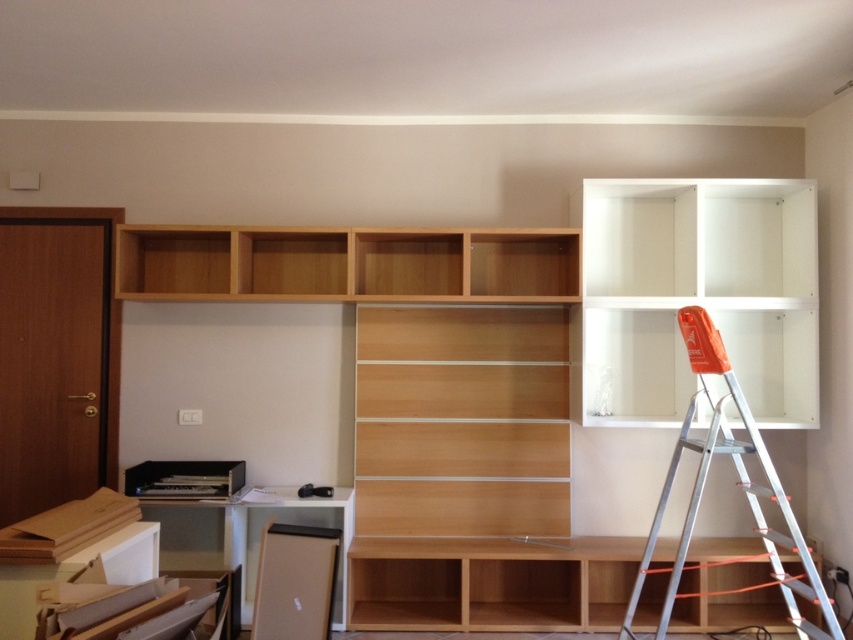
Question: Which of the following is the farthest from the observer?

Choices:
 (A) white matte shelf at upper right
 (B) light wood shelf at center
 (C) silver metallic ladder at upper right
 (D) light wood shelves at center

Answer: (A)

Question: Is white matte cabinet at upper right below white matte shelf at upper right?

Choices:
 (A) yes
 (B) no

Answer: (B)

Question: Does white matte cabinet at upper right come behind light wood shelves at center?

Choices:
 (A) no
 (B) yes

Answer: (B)

Question: Which of the following is the closest to the observer?

Choices:
 (A) (587, 296)
 (B) (810, 628)

Answer: (B)

Question: Which of the following is the farthest from the observer?

Choices:
 (A) (354, 272)
 (B) (793, 516)
 (C) (692, 390)

Answer: (C)

Question: Does light wood bookshelf at center have a smaller size compared to white matte cabinet at upper right?

Choices:
 (A) no
 (B) yes

Answer: (A)